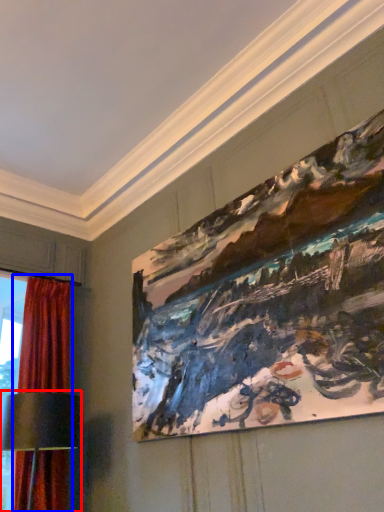
Question: Which object appears farthest to the camera in this image, table lamp (highlighted by a red box) or curtain (highlighted by a blue box)?

Choices:
 (A) table lamp
 (B) curtain

Answer: (B)